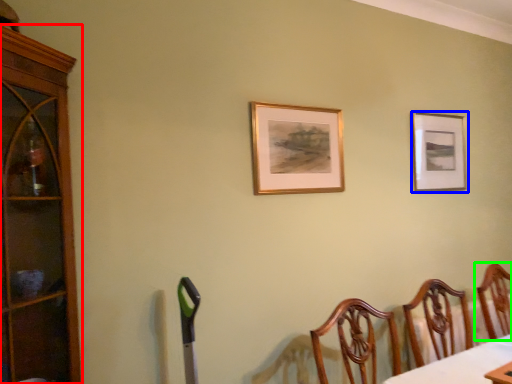
Question: Estimate the real-world distances between objects in this image. Which object is closer to cabinetry (highlighted by a red box), picture frame (highlighted by a blue box) or chair (highlighted by a green box)?

Choices:
 (A) picture frame
 (B) chair

Answer: (A)